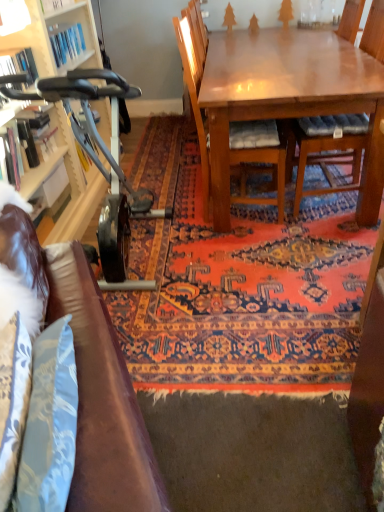
Measure the distance between point (117, 253) and camera.

The distance of point (117, 253) from camera is 7.01 feet.

Image resolution: width=384 pixels, height=512 pixels. I want to click on wooden chair with cushion at center, the 2th chair in the left-to-right sequence, so click(319, 161).

Describe the element at coordinates (90, 376) in the screenshot. I see `brown leather couch at lower left` at that location.

What are the coordinates of `matte white cabinet at left` in the screenshot? It's located at (75, 186).

The width and height of the screenshot is (384, 512). I want to click on wooden bookshelf at left, so click(40, 173).

Measure the distance between point [244,142] and camera.

Point [244,142] is 2.24 meters away from camera.

Identify the location of metallic gray exercise bike at left. The height and width of the screenshot is (512, 384). (103, 166).

Is there a large distance between shiny brown table at upper right and wooden chair with cushion at center, the 2th chair in the left-to-right sequence?

Actually, shiny brown table at upper right and wooden chair with cushion at center, the 2th chair in the left-to-right sequence, are a little close together.

Can you confirm if shiny brown table at upper right is positioned to the left of wooden chair with cushion at center, which ranks as the 1th chair in right-to-left order?

Indeed, shiny brown table at upper right is positioned on the left side of wooden chair with cushion at center, which ranks as the 1th chair in right-to-left order.

Considering the sizes of objects shiny brown table at upper right and wooden chair with cushion at center, the 2th chair in the left-to-right sequence, in the image provided, who is taller, shiny brown table at upper right or wooden chair with cushion at center, the 2th chair in the left-to-right sequence,?

wooden chair with cushion at center, the 2th chair in the left-to-right sequence, is taller.

From a real-world perspective, is wooden chair with cushion at center, the 2th chair in the left-to-right sequence, below carpeted rug at center?

No, from a real-world perspective, wooden chair with cushion at center, the 2th chair in the left-to-right sequence, is not below carpeted rug at center.

Is wooden chair with cushion at center, which ranks as the 1th chair in right-to-left order, behind carpeted rug at center?

Yes, wooden chair with cushion at center, which ranks as the 1th chair in right-to-left order, is further from the camera.

Between wooden chair with cushion at center, the 2th chair in the left-to-right sequence, and carpeted rug at center, which one appears on the right side from the viewer's perspective?

wooden chair with cushion at center, the 2th chair in the left-to-right sequence, is more to the right.

Locate an element on the screen. This screenshot has height=512, width=384. chair that is the 2nd one when counting rightward from the carpeted rug at center is located at coordinates (319, 161).

Would you say wooden bookshelf at left is a long distance from matte white cabinet at left?

No, wooden bookshelf at left is not far away from matte white cabinet at left.

From the image's perspective, is wooden bookshelf at left beneath matte white cabinet at left?

No.

Looking at their sizes, would you say wooden bookshelf at left is wider or thinner than matte white cabinet at left?

Clearly, wooden bookshelf at left has more width compared to matte white cabinet at left.

Can you confirm if wooden bookshelf at left is taller than matte white cabinet at left?

In fact, wooden bookshelf at left may be shorter than matte white cabinet at left.

From a real-world perspective, does matte white cabinet at left sit lower than wooden chair with cushion at center, which ranks as the 1th chair in right-to-left order?

No, from a real-world perspective, matte white cabinet at left is not beneath wooden chair with cushion at center, which ranks as the 1th chair in right-to-left order.

Who is shorter, matte white cabinet at left or wooden chair with cushion at center, which ranks as the 1th chair in right-to-left order?

matte white cabinet at left is shorter.

How much distance is there between matte white cabinet at left and wooden chair with cushion at center, which ranks as the 1th chair in right-to-left order?

matte white cabinet at left and wooden chair with cushion at center, which ranks as the 1th chair in right-to-left order, are 1.40 meters apart from each other.

From the image's perspective, is matte white cabinet at left located beneath wooden chair with cushion at center, the 2th chair in the left-to-right sequence?

Indeed, from the image's perspective, matte white cabinet at left is shown beneath wooden chair with cushion at center, the 2th chair in the left-to-right sequence.

In terms of height, does wooden bookshelf at left look taller or shorter compared to metallic gray exercise bike at left?

Considering their sizes, wooden bookshelf at left has less height than metallic gray exercise bike at left.

From a real-world perspective, is wooden bookshelf at left on top of metallic gray exercise bike at left?

Correct, in the physical world, wooden bookshelf at left is higher than metallic gray exercise bike at left.

Which is in front, point (51, 157) or point (107, 285)?

The point (107, 285) is in front.

From the picture: Does wooden bookshelf at left appear on the left side of metallic gray exercise bike at left?

Correct, you'll find wooden bookshelf at left to the left of metallic gray exercise bike at left.

Is wooden chair at center, acting as the second chair starting from the right, positioned with its back to brown leather couch at lower left?

No.

Based on the photo, considering the sizes of objects wooden chair at center, acting as the second chair starting from the right, and brown leather couch at lower left in the image provided, who is smaller, wooden chair at center, acting as the second chair starting from the right, or brown leather couch at lower left?

With smaller size is brown leather couch at lower left.

From a real-world perspective, is wooden chair at center, the first chair when ordered from left to right, physically below brown leather couch at lower left?

No, from a real-world perspective, wooden chair at center, the first chair when ordered from left to right, is not beneath brown leather couch at lower left.

From the image's perspective, is matte white cabinet at left above carpeted rug at center?

Actually, matte white cabinet at left appears below carpeted rug at center in the image.

Is matte white cabinet at left positioned with its back to carpeted rug at center?

No.

Which is more to the left, matte white cabinet at left or carpeted rug at center?

From the viewer's perspective, matte white cabinet at left appears more on the left side.

Is matte white cabinet at left with carpeted rug at center?

No, matte white cabinet at left is not in contact with carpeted rug at center.

Identify the location of desk that appears below the wooden chair with cushion at center, which ranks as the 1th chair in right-to-left order (from a real-world perspective). This screenshot has height=512, width=384. (290, 98).

From a real-world perspective, starting from the carpeted rug at center, which chair is the 2nd one vertically above it? Please provide its 2D coordinates.

[(319, 161)]

In the scene shown: Looking at the image, which one is located further to matte white cabinet at left, carpeted rug at center or wooden chair at center, the first chair when ordered from left to right?

Among the two, wooden chair at center, the first chair when ordered from left to right, is located further to matte white cabinet at left.

When comparing their distances from brown leather couch at lower left, does carpeted rug at center or wooden bookshelf at left seem further?

Among the two, wooden bookshelf at left is located further to brown leather couch at lower left.

Based on the photo, which object lies further to the anchor point wooden bookshelf at left, carpeted rug at center or wooden chair with cushion at center, the 2th chair in the left-to-right sequence?

wooden chair with cushion at center, the 2th chair in the left-to-right sequence, is positioned further to the anchor wooden bookshelf at left.

From the image, which object appears to be farther from wooden bookshelf at left, shiny brown table at upper right or matte white cabinet at left?

Based on the image, shiny brown table at upper right appears to be further to wooden bookshelf at left.

Estimate the real-world distances between objects in this image. Which object is further from brown leather couch at lower left, wooden chair at center, the first chair when ordered from left to right, or wooden bookshelf at left?

The object further to brown leather couch at lower left is wooden chair at center, the first chair when ordered from left to right.

Which object lies nearer to the anchor point wooden bookshelf at left, metallic gray exercise bike at left or shiny brown table at upper right?

metallic gray exercise bike at left is closer to wooden bookshelf at left.

Which object lies nearer to the anchor point wooden bookshelf at left, metallic gray exercise bike at left or matte white cabinet at left?

metallic gray exercise bike at left is positioned closer to the anchor wooden bookshelf at left.

Considering their positions, is wooden bookshelf at left positioned further to brown leather couch at lower left than matte white cabinet at left?

Based on the image, matte white cabinet at left appears to be further to brown leather couch at lower left.

I want to click on mat between matte white cabinet at left and wooden chair with cushion at center, the 2th chair in the left-to-right sequence, from left to right, so click(238, 285).

In order to click on desk positioned between brown leather couch at lower left and wooden chair with cushion at center, the 2th chair in the left-to-right sequence, from near to far in this screenshot , I will do `click(290, 98)`.

You are a GUI agent. You are given a task and a screenshot of the screen. Output one action in this format:
    pyautogui.click(x=<x>, y=<y>)
    Task: Click on the mat between brown leather couch at lower left and wooden chair at center, the first chair when ordered from left to right, from front to back
    
    Given the screenshot: What is the action you would take?
    pyautogui.click(x=238, y=285)

At what (x,y) coordinates should I click in order to perform the action: click on mat located between wooden bookshelf at left and shiny brown table at upper right in the left-right direction. Please return your answer as a coordinate pair (x, y). This screenshot has height=512, width=384. Looking at the image, I should click on (238, 285).